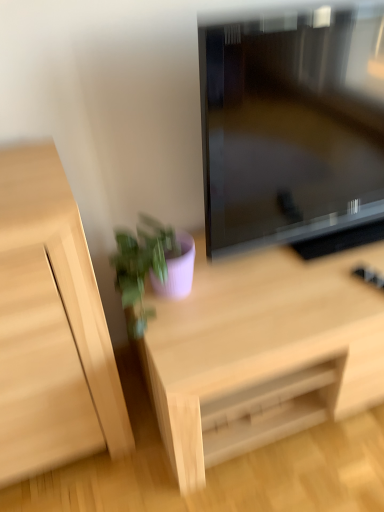
The height and width of the screenshot is (512, 384). What are the coordinates of `matte black television at center` in the screenshot? It's located at (291, 125).

What do you see at coordinates (143, 265) in the screenshot?
I see `matte purple pot at lower center` at bounding box center [143, 265].

What do you see at coordinates (51, 325) in the screenshot? I see `light wood cabinet at left` at bounding box center [51, 325].

Where is `matte black television at center`? The width and height of the screenshot is (384, 512). matte black television at center is located at coordinates (291, 125).

Is light wood cabinet at left touching matte black television at center?

No, light wood cabinet at left is not touching matte black television at center.

From the picture: From a real-world perspective, who is located higher, light wood cabinet at left or matte black television at center?

matte black television at center, from a real-world perspective.

From the image's perspective, does light wood cabinet at left appear lower than matte black television at center?

Yes.

Could you tell me if light wood cabinet at left is facing matte black television at center?

No, light wood cabinet at left is not turned towards matte black television at center.

Is matte purple pot at lower center positioned behind light wood cabinet at left?

Yes, it is behind light wood cabinet at left.

From the image's perspective, which is below, matte purple pot at lower center or light wood cabinet at left?

light wood cabinet at left, from the image's perspective.

Between matte purple pot at lower center and light wood cabinet at left, which one has larger width?

light wood cabinet at left is wider.

Is matte purple pot at lower center spatially inside light wood cabinet at left, or outside of it?

matte purple pot at lower center lies outside light wood cabinet at left.

Considering the points (315, 346) and (357, 180), which point is behind, point (315, 346) or point (357, 180)?

The point (357, 180) is behind.

From the picture: From a real-world perspective, which is physically below, light wood desk at center or matte black television at center?

light wood desk at center is physically lower.

Between light wood desk at center and matte black television at center, which one appears on the left side from the viewer's perspective?

matte black television at center.

Can you tell me how much light wood desk at center and matte black television at center differ in facing direction?

0.000344 degrees separate the facing orientations of light wood desk at center and matte black television at center.

Measure the distance from matte purple pot at lower center to light wood desk at center.

A distance of 12.16 inches exists between matte purple pot at lower center and light wood desk at center.

Which of these two, matte purple pot at lower center or light wood desk at center, stands shorter?

matte purple pot at lower center.

From the image's perspective, is matte purple pot at lower center on light wood desk at center?

Correct, matte purple pot at lower center appears higher than light wood desk at center in the image.

Is matte purple pot at lower center bigger than light wood desk at center?

No.

Considering the positions of objects matte black television at center and light wood desk at center in the image provided, who is more to the right, matte black television at center or light wood desk at center?

From the viewer's perspective, light wood desk at center appears more on the right side.

In order to click on television in front of the light wood desk at center in this screenshot , I will do `click(291, 125)`.

Could you tell me if matte black television at center is turned towards light wood desk at center?

No, matte black television at center is not oriented towards light wood desk at center.

How many degrees apart are the facing directions of matte black television at center and light wood desk at center?

0.000344 degrees.

Is matte black television at center shorter than matte purple pot at lower center?

No.

Is matte black television at center surrounding matte purple pot at lower center?

No.

Is matte black television at center next to matte purple pot at lower center?

matte black television at center and matte purple pot at lower center are clearly separated.

Based on their sizes in the image, would you say matte black television at center is bigger or smaller than matte purple pot at lower center?

In the image, matte black television at center appears to be larger than matte purple pot at lower center.

Considering the points (383, 75) and (19, 247), which point is behind, point (383, 75) or point (19, 247)?

The point (383, 75) is farther from the camera.

At what (x,y) coordinates should I click in order to perform the action: click on television that appears above the light wood cabinet at left (from a real-world perspective). Please return your answer as a coordinate pair (x, y). This screenshot has height=512, width=384. Looking at the image, I should click on (291, 125).

Considering the relative positions of matte black television at center and light wood cabinet at left in the image provided, is matte black television at center behind light wood cabinet at left?

Yes.

The width and height of the screenshot is (384, 512). What are the coordinates of `television above the light wood cabinet at left (from the image's perspective)` in the screenshot? It's located at (291, 125).

Find the location of a particular element. The height and width of the screenshot is (512, 384). houseplant above the light wood cabinet at left (from a real-world perspective) is located at coordinates (143, 265).

Estimate the real-world distances between objects in this image. Which object is closer to light wood desk at center, light wood cabinet at left or matte purple pot at lower center?

matte purple pot at lower center is positioned closer to the anchor light wood desk at center.

In the scene shown: When comparing their distances from matte purple pot at lower center, does light wood desk at center or matte black television at center seem closer?

Among the two, light wood desk at center is located nearer to matte purple pot at lower center.

When comparing their distances from matte purple pot at lower center, does light wood desk at center or light wood cabinet at left seem closer?

light wood cabinet at left.

Which object lies further to the anchor point matte purple pot at lower center, matte black television at center or light wood cabinet at left?

matte black television at center is positioned further to the anchor matte purple pot at lower center.

Which object lies nearer to the anchor point light wood cabinet at left, matte purple pot at lower center or light wood desk at center?

matte purple pot at lower center.

Considering their positions, is light wood cabinet at left positioned further to matte purple pot at lower center than light wood desk at center?

light wood desk at center is positioned further to the anchor matte purple pot at lower center.

In the scene shown: Considering their positions, is light wood desk at center positioned closer to matte black television at center than light wood cabinet at left?

light wood desk at center is closer to matte black television at center.

Which object lies further to the anchor point light wood desk at center, light wood cabinet at left or matte black television at center?

Among the two, light wood cabinet at left is located further to light wood desk at center.

Where is `houseplant between light wood cabinet at left and light wood desk at center in the horizontal direction`? The image size is (384, 512). houseplant between light wood cabinet at left and light wood desk at center in the horizontal direction is located at coordinates (143, 265).

At what (x,y) coordinates should I click in order to perform the action: click on houseplant between matte black television at center and light wood desk at center in the vertical direction. Please return your answer as a coordinate pair (x, y). This screenshot has width=384, height=512. Looking at the image, I should click on (143, 265).

This screenshot has height=512, width=384. Find the location of `television located between light wood cabinet at left and light wood desk at center in the left-right direction`. television located between light wood cabinet at left and light wood desk at center in the left-right direction is located at coordinates (291, 125).

Where is `houseplant between light wood cabinet at left and matte black television at center`? This screenshot has height=512, width=384. houseplant between light wood cabinet at left and matte black television at center is located at coordinates (143, 265).